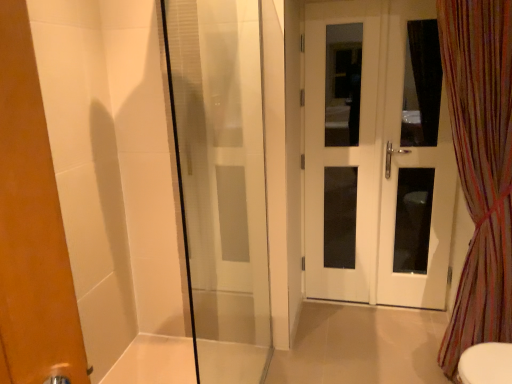
Find the location of a particular element. The image size is (512, 384). vacant space in front of white glossy door at right is located at coordinates (388, 338).